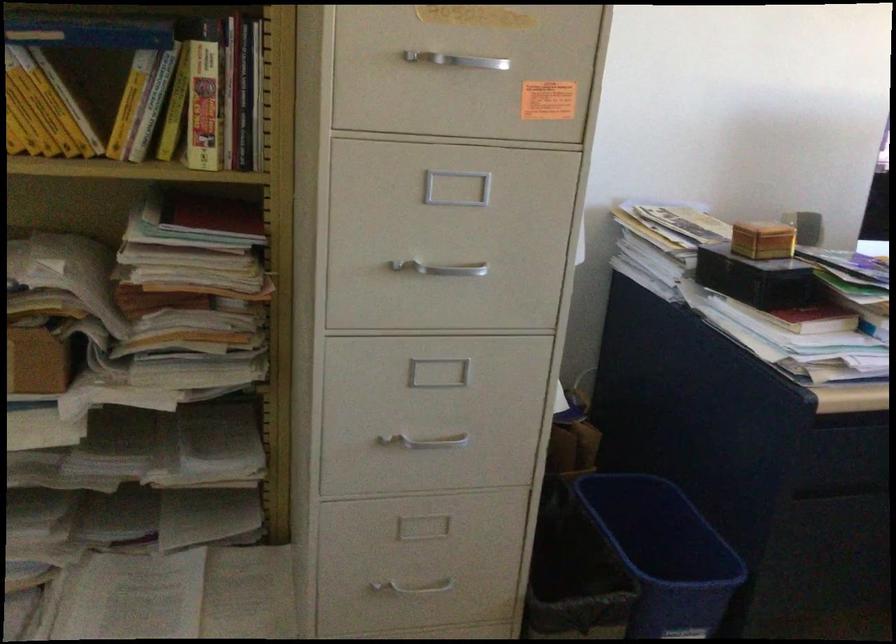
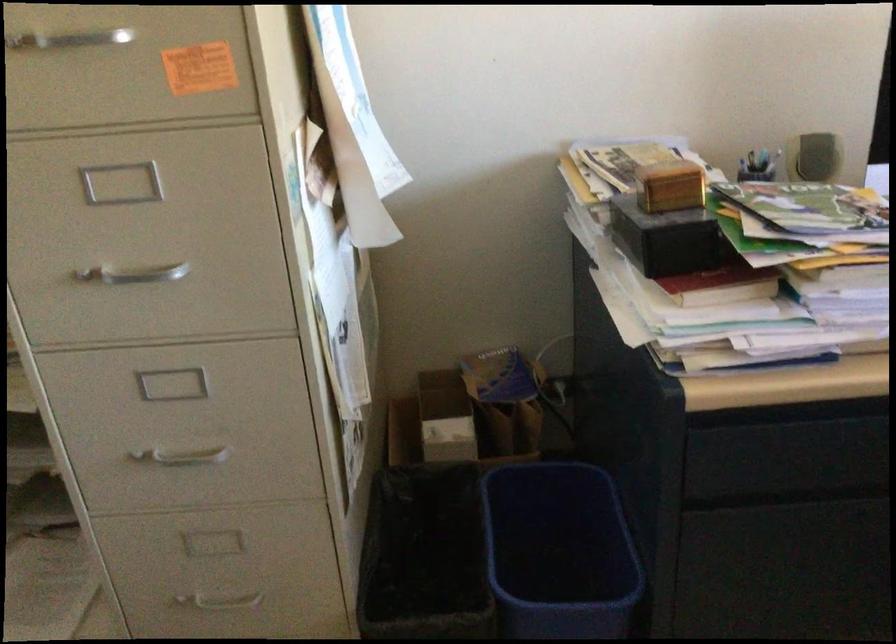
Locate, in the second image, the point that corresponds to point 433,269 in the first image.

(134, 274)